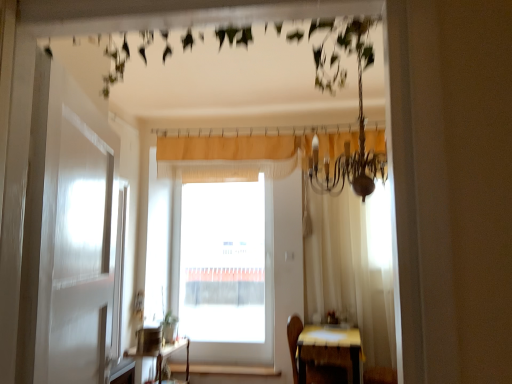
Question: Should I look upward or downward to see wooden table at lower right, positioned as the 1th table in right-to-left order?

Choices:
 (A) down
 (B) up

Answer: (A)

Question: Is transparent glass window at center inside beige textured curtain at center?

Choices:
 (A) yes
 (B) no

Answer: (B)

Question: Is beige textured curtain at center to the left of transparent glass window at center from the viewer's perspective?

Choices:
 (A) yes
 (B) no

Answer: (B)

Question: From a real-world perspective, is beige textured curtain at center located higher than transparent glass window at center?

Choices:
 (A) no
 (B) yes

Answer: (B)

Question: Is beige textured curtain at center not inside transparent glass window at center?

Choices:
 (A) yes
 (B) no

Answer: (A)

Question: Is beige textured curtain at center far away from transparent glass window at center?

Choices:
 (A) no
 (B) yes

Answer: (B)

Question: Is beige textured curtain at center bigger than transparent glass window at center?

Choices:
 (A) yes
 (B) no

Answer: (B)

Question: From a real-world perspective, is wooden at lower center positioned under wooden table at lower right, positioned as the 1th table in right-to-left order, based on gravity?

Choices:
 (A) yes
 (B) no

Answer: (A)

Question: Is wooden at lower center bigger than wooden table at lower right, positioned as the 1th table in right-to-left order?

Choices:
 (A) yes
 (B) no

Answer: (B)

Question: Is wooden table at lower right, which is the second table from left to right, inside wooden at lower center?

Choices:
 (A) no
 (B) yes

Answer: (A)

Question: Is there a large distance between wooden at lower center and wooden table at lower right, positioned as the 1th table in right-to-left order?

Choices:
 (A) no
 (B) yes

Answer: (B)

Question: Is the position of wooden at lower center less distant than that of wooden table at lower right, which is the second table from left to right?

Choices:
 (A) yes
 (B) no

Answer: (B)

Question: From the image's perspective, is wooden at lower center under wooden table at lower right, which is the second table from left to right?

Choices:
 (A) no
 (B) yes

Answer: (B)

Question: Can you confirm if wooden at lower center is shorter than transparent glass window at center?

Choices:
 (A) yes
 (B) no

Answer: (A)